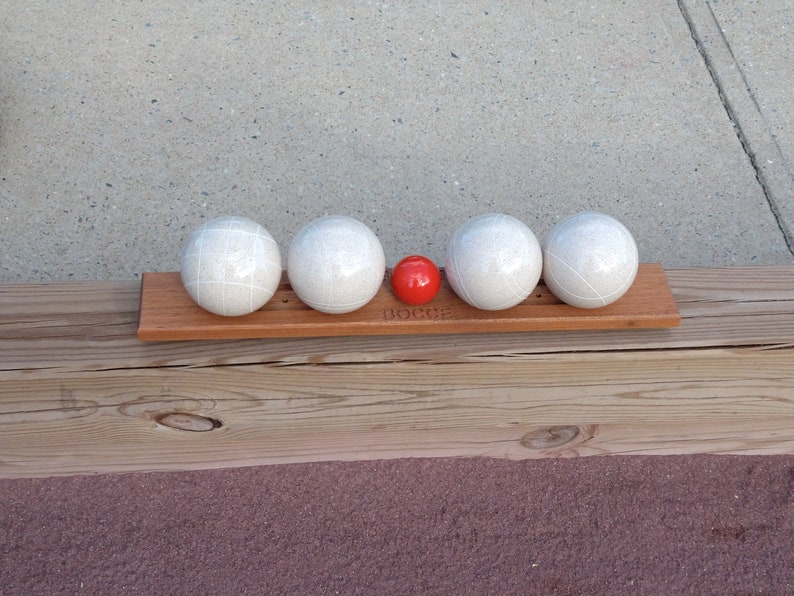
The height and width of the screenshot is (596, 794). In order to click on wooden ball holder in this screenshot , I will do `click(649, 303)`.